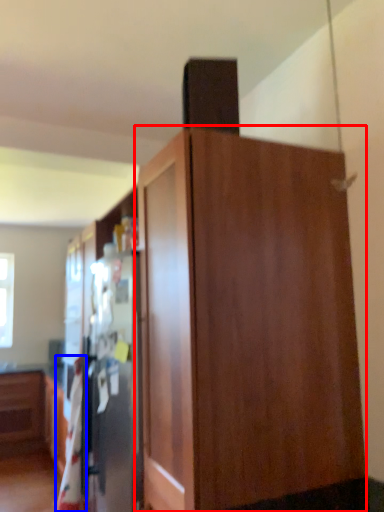
Question: Which of the following is the farthest to the observer, cupboard (highlighted by a red box) or blanket (highlighted by a blue box)?

Choices:
 (A) cupboard
 (B) blanket

Answer: (B)